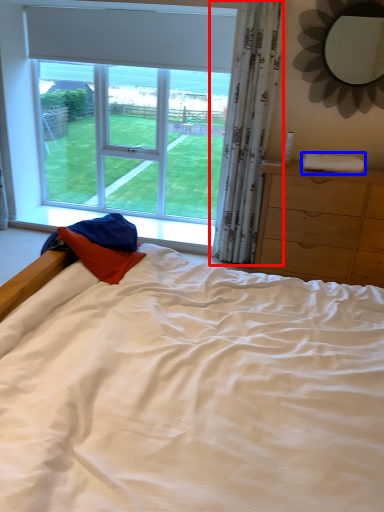
Question: Which point is closer to the camera, curtain (highlighted by a red box) or cloth (highlighted by a blue box)?

Choices:
 (A) curtain
 (B) cloth

Answer: (A)